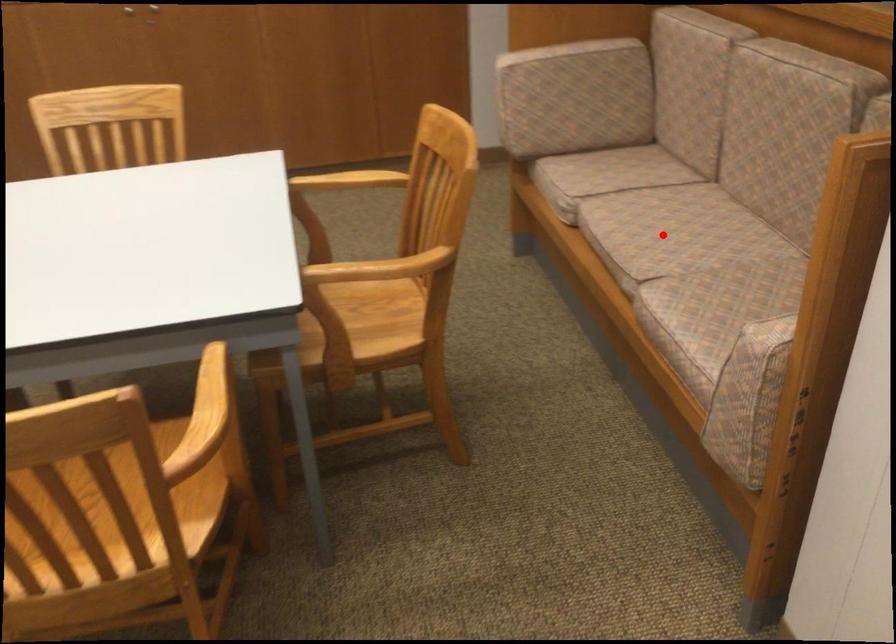
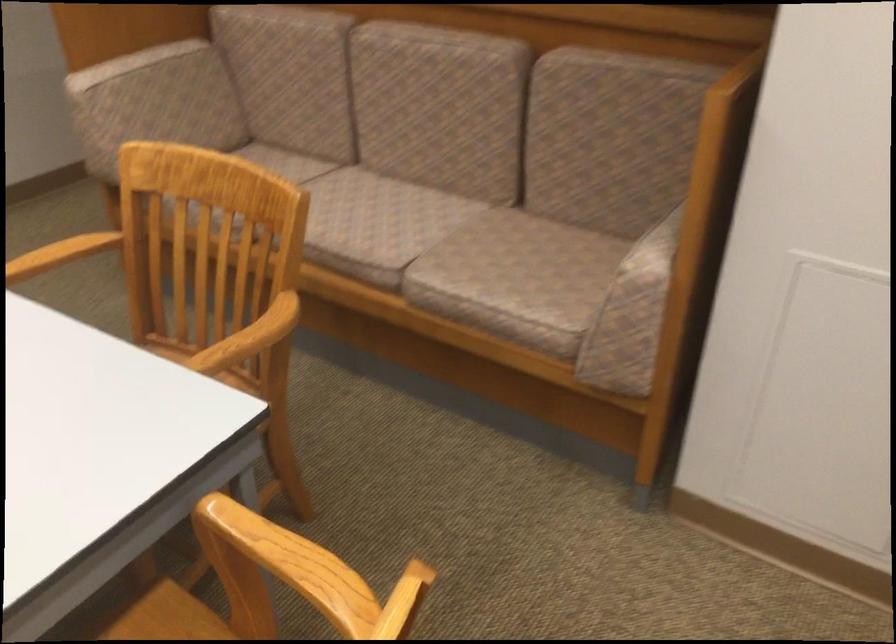
The point at the highlighted location is marked in the first image. Where is the corresponding point in the second image?

(378, 223)